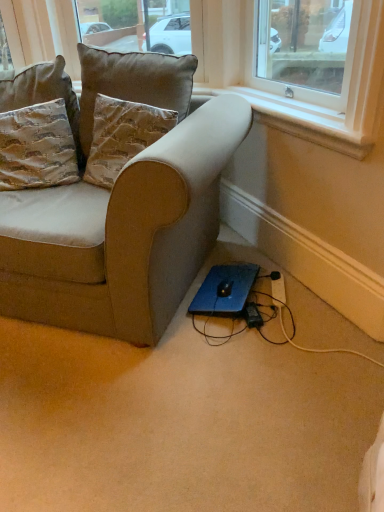
Question: Is point (102, 186) positioned closer to the camera than point (115, 208)?

Choices:
 (A) closer
 (B) farther

Answer: (B)

Question: From a real-world perspective, is suede textured pillow at upper left, the second pillow from the right, above or below suede beige couch at lower left?

Choices:
 (A) below
 (B) above

Answer: (B)

Question: Estimate the real-world distances between objects in this image. Which object is closer to the velvet textured pillow at upper left, the first pillow from the right?

Choices:
 (A) suede beige couch at lower left
 (B) black plastic plug at lower center
 (C) camouflage fabric pillow at left, the third pillow positioned from the right
 (D) black plastic extension cord at lower right
 (E) white plastic window sill at upper right

Answer: (C)

Question: Estimate the real-world distances between objects in this image. Which object is closer to the suede beige couch at lower left?

Choices:
 (A) velvet textured pillow at upper left, the 3th pillow from the left
 (B) black plastic extension cord at lower right
 (C) black plastic plug at lower center
 (D) suede textured pillow at upper left, the second pillow from the right
 (E) white plastic window sill at upper right

Answer: (D)